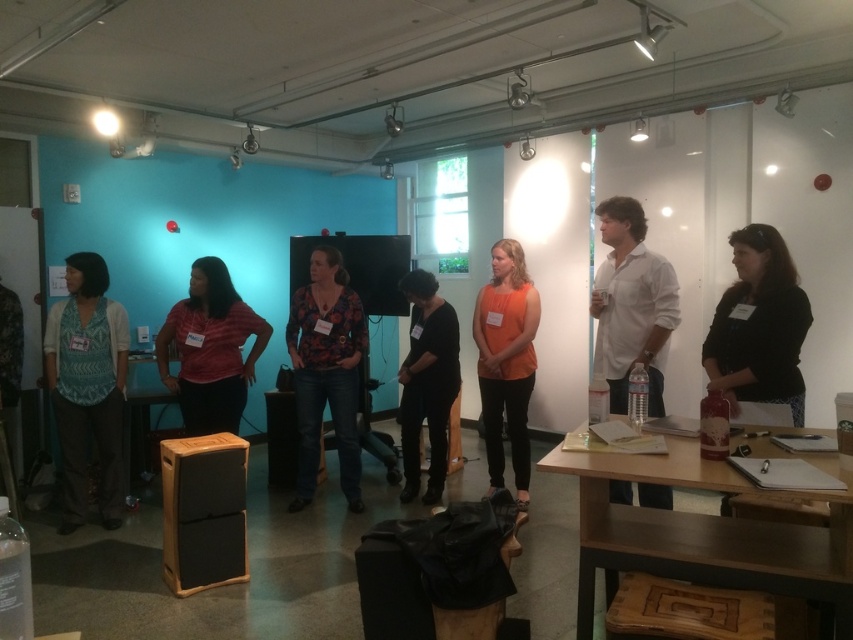
You are organizing a small meeting in this room and need to place a 1.2 meter wide laptop on the wooden table at lower right. Can the laptop fit on the table? Please consider the table size relative to the matte red shirt at center.

The wooden table at lower right is wider than the matte red shirt at center. Since the shirt is likely smaller than the table, the 1.2 meter laptop might fit, but without exact measurements, it is uncertain. However, the description only states the table is wider than the shirt, not the shirt size. Thus, we cannot confirm if the laptop will fit based on the given information.